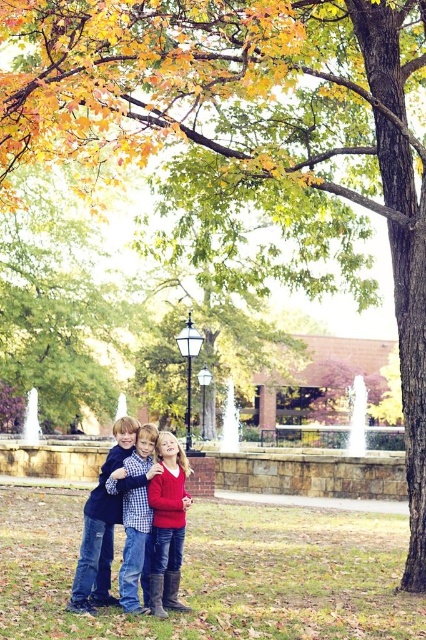
You are a photographer trying to capture a photo of the children in the scene. You notice the matte red sweater at center and the checkered fabric shirt at center. Which child should you focus on if you want to highlight someone whose clothing is shorter in length?

The matte red sweater at center is shorter than the checkered fabric shirt at center, so focusing on the child wearing the matte red sweater at center would highlight someone with shorter clothing.

You are a photographer trying to capture a clear shot of the checkered fabric shirt at center and denim jeans at center. Which one should you focus on first to ensure it appears sharp in the photo?

You should focus on the denim jeans at center first because it is closer to you than the checkered fabric shirt at center, so focusing on it will ensure it stays sharp while the background might blur slightly.

You are a photographer trying to capture the matte red sweater at center in the autumn scene. Based on the coordinates provided, where should you focus your camera to ensure the sweater is in the frame?

The matte red sweater at center is located at point 0.820 on the horizontal axis and 0.394 on the vertical axis, so you should focus your camera at those coordinates to ensure the sweater is centered in the frame.